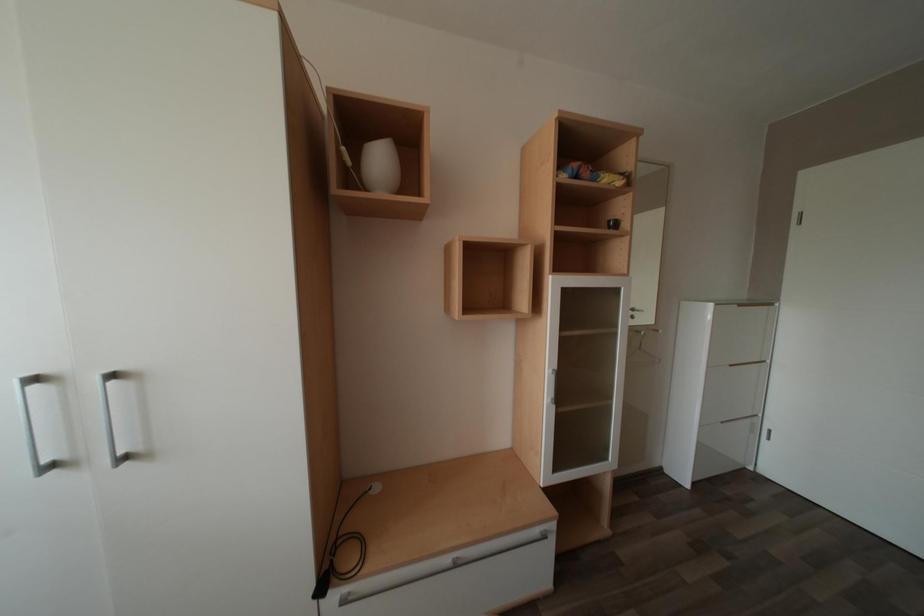
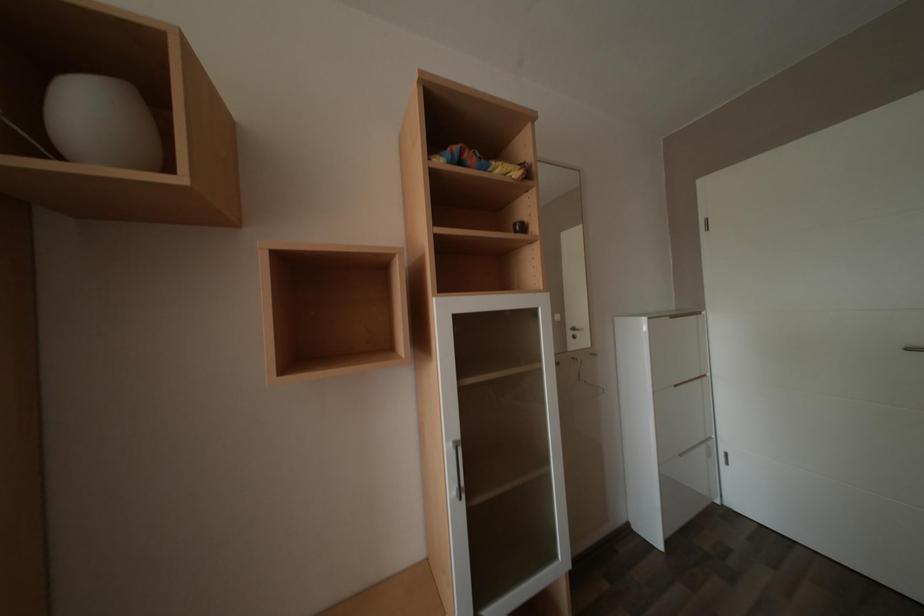
Question: The camera is either moving clockwise (left) or counter-clockwise (right) around the object. The first image is from the beginning of the video and the second image is from the end. Is the camera moving left or right when shooting the video?

Choices:
 (A) Left
 (B) Right

Answer: (A)